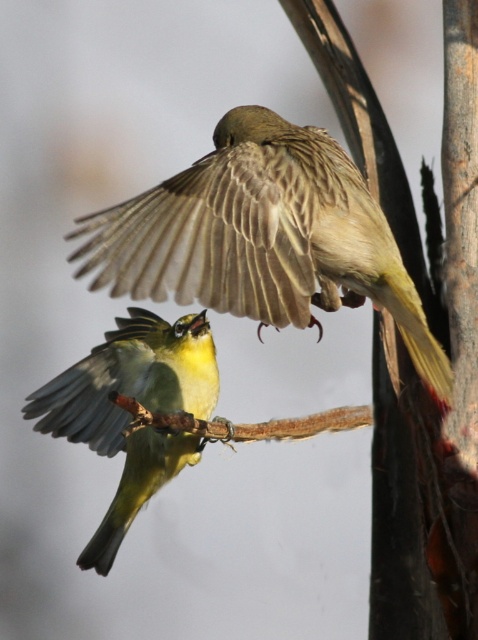
Does brown textured bird at upper center appear on the right side of yellow-green feathers at center?

Yes, brown textured bird at upper center is to the right of yellow-green feathers at center.

Does point (282, 220) come farther from viewer compared to point (116, 513)?

No, it is not.

You are a GUI agent. You are given a task and a screenshot of the screen. Output one action in this format:
    pyautogui.click(x=<x>, y=<y>)
    Task: Click on the brown textured bird at upper center
    This screenshot has height=640, width=478.
    Given the screenshot: What is the action you would take?
    pyautogui.click(x=263, y=236)